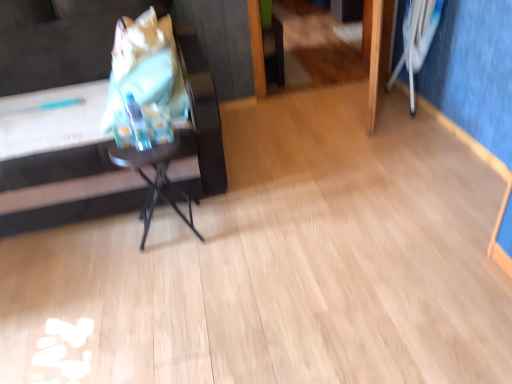
This screenshot has height=384, width=512. In order to click on free space to the right of metallic black table at center in this screenshot , I will do click(231, 226).